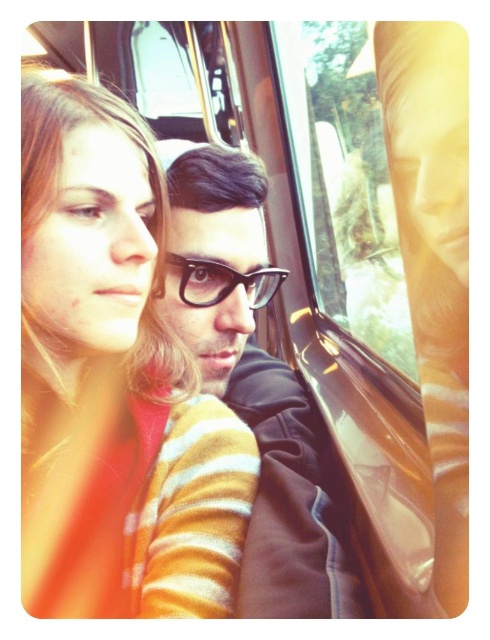
Is black matte glasses at center shorter than black plastic glasses at center?

No.

Based on the photo, between black matte glasses at center and black plastic glasses at center, which one has less height?

black plastic glasses at center is shorter.

Who is more distant from viewer, (203, 262) or (194, 291)?

The point (194, 291) is behind.

Identify the location of black matte glasses at center. Image resolution: width=490 pixels, height=640 pixels. (255, 387).

Is point (25, 429) positioned in front of point (311, 100)?

Yes, point (25, 429) is in front of point (311, 100).

Is point (146, 484) positioned in front of point (303, 188)?

That is True.

The image size is (490, 640). What are the coordinates of `matte orange sweater at left` in the screenshot? It's located at (113, 381).

I want to click on matte orange sweater at left, so click(113, 381).

Can you confirm if matte orange sweater at left is wider than black plastic glasses at center?

Yes, matte orange sweater at left is wider than black plastic glasses at center.

What do you see at coordinates (113, 381) in the screenshot? I see `matte orange sweater at left` at bounding box center [113, 381].

Image resolution: width=490 pixels, height=640 pixels. In order to click on matte orange sweater at left in this screenshot , I will do `click(113, 381)`.